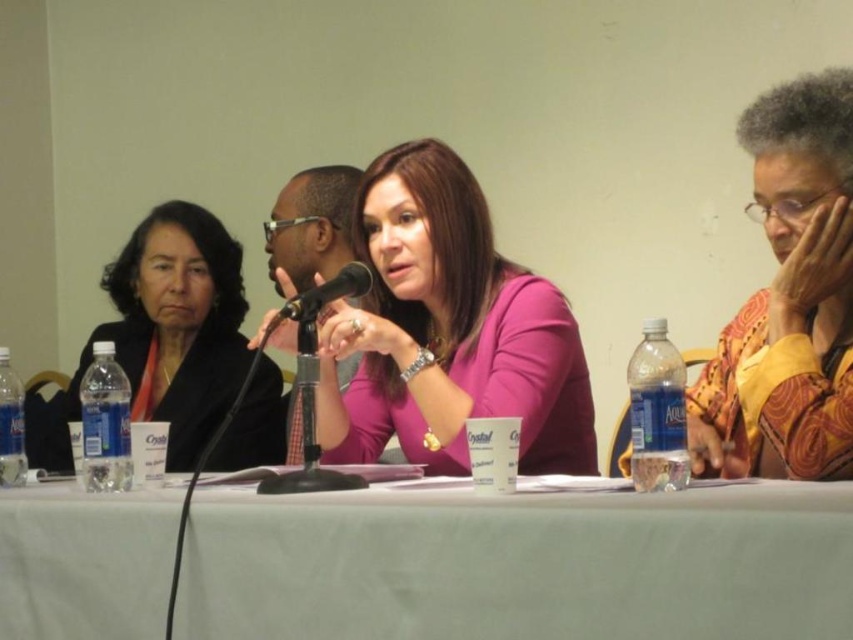
Question: Considering the real-world distances, which object is closest to the black metallic microphone at center?

Choices:
 (A) pink matte shirt at center
 (B) white fabric table at center

Answer: (A)

Question: Is pink matte shirt at center smaller than yellow textured blouse at right?

Choices:
 (A) yes
 (B) no

Answer: (B)

Question: Is yellow textured blouse at right to the left of black metallic microphone at center from the viewer's perspective?

Choices:
 (A) no
 (B) yes

Answer: (A)

Question: Which point is closer to the camera?

Choices:
 (A) (521, 280)
 (B) (848, 486)

Answer: (B)

Question: Does white fabric table at center appear on the left side of yellow textured blouse at right?

Choices:
 (A) yes
 (B) no

Answer: (A)

Question: Based on their relative distances, which object is farther from the matte black jacket at left?

Choices:
 (A) pink matte shirt at center
 (B) white fabric table at center
 (C) black metallic microphone at center

Answer: (B)